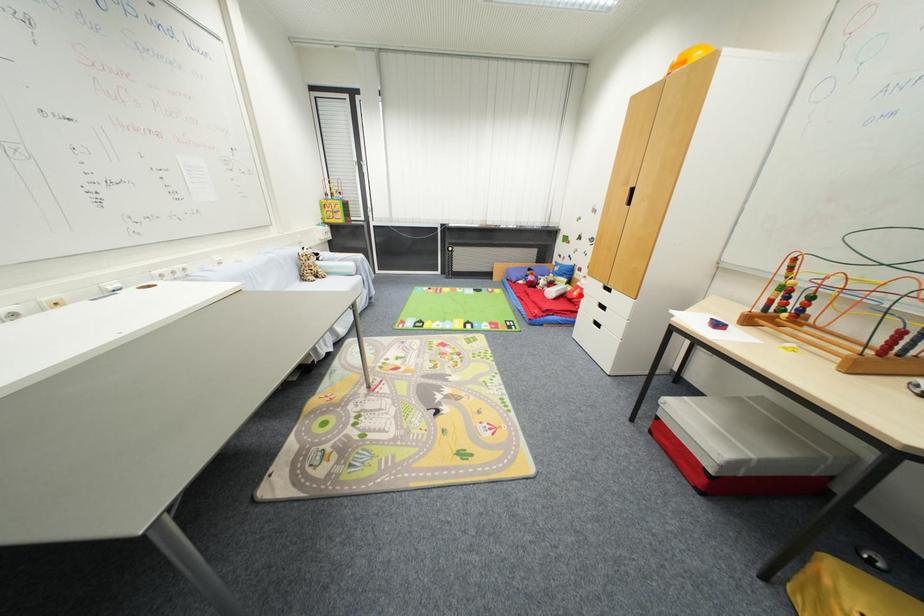
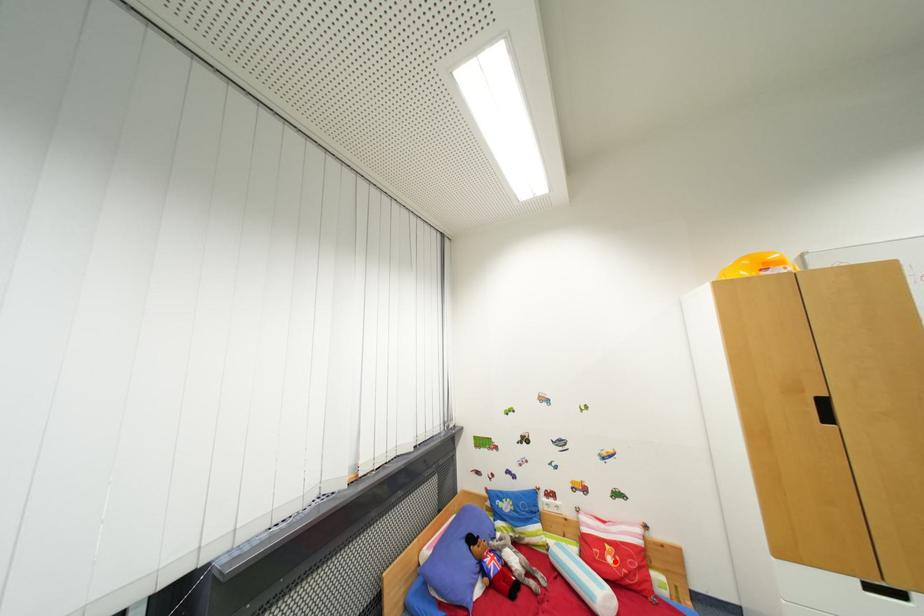
I am providing you with two images of the same scene from different viewpoints. A red point is marked on the first image and another point is marked on the second image. Is the red point in image1 aligned with the point shown in image2?

Yes